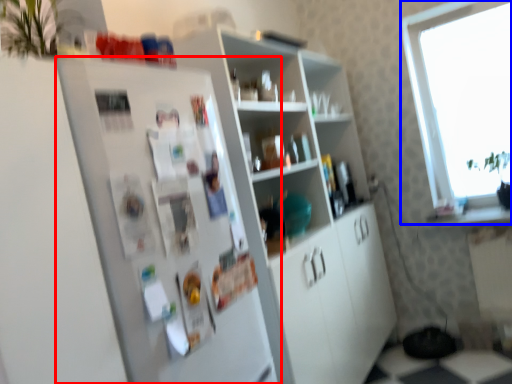
Question: Which object is closer to the camera taking this photo, fridge (highlighted by a red box) or window (highlighted by a blue box)?

Choices:
 (A) fridge
 (B) window

Answer: (A)